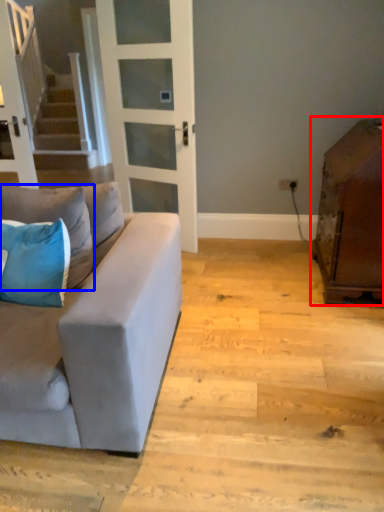
Question: Which object appears farthest to the camera in this image, cabinetry (highlighted by a red box) or pillow (highlighted by a blue box)?

Choices:
 (A) cabinetry
 (B) pillow

Answer: (A)